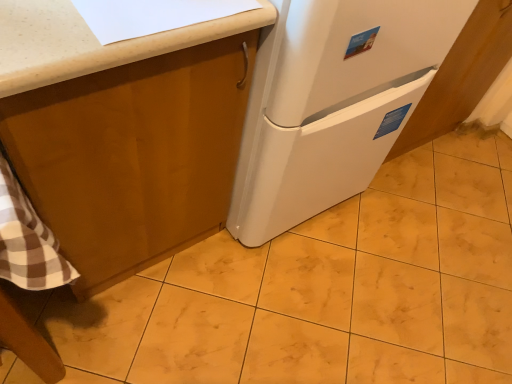
Where is `vacant space in front of white glossy cabinet at lower right, the 1th cabinetry in the right-to-left sequence`? The image size is (512, 384). vacant space in front of white glossy cabinet at lower right, the 1th cabinetry in the right-to-left sequence is located at coordinates (421, 210).